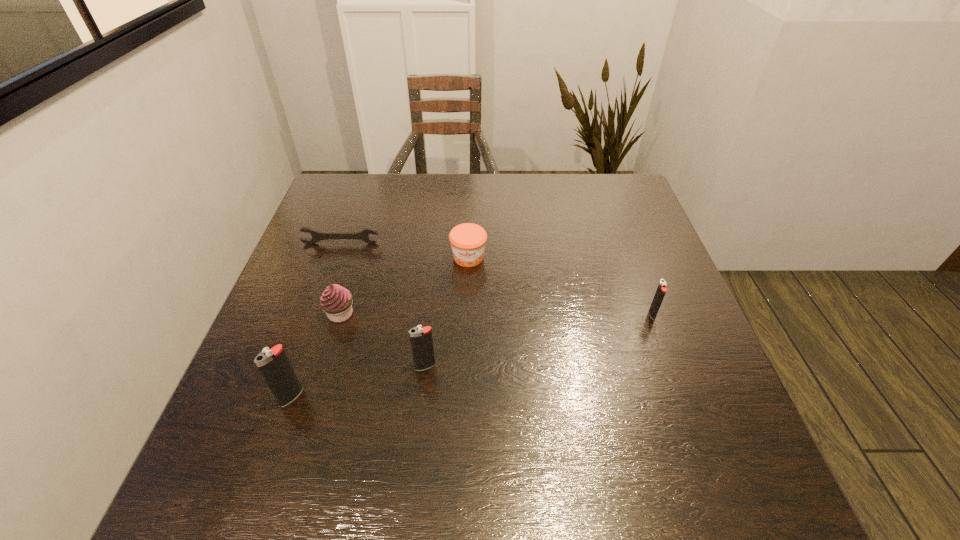
The height and width of the screenshot is (540, 960). What are the coordinates of `the tallest object` in the screenshot? It's located at (274, 365).

Where is `the nearest object`? The image size is (960, 540). the nearest object is located at coordinates (274, 365).

In order to click on the fifth shortest object in this screenshot , I will do tap(421, 340).

Where is `the second tallest igniter`? This screenshot has width=960, height=540. the second tallest igniter is located at coordinates (421, 340).

Find the location of `the farthest igniter`. the farthest igniter is located at coordinates (661, 290).

Locate an element on the screen. the rightmost igniter is located at coordinates (661, 290).

Find the location of a particular element. This screenshot has height=540, width=960. jam is located at coordinates (468, 240).

Find the location of a particular element. The image size is (960, 540). the fifth nearest object is located at coordinates (468, 240).

Find the location of a particular element. the farthest object is located at coordinates (317, 236).

The image size is (960, 540). Find the location of `wrench`. wrench is located at coordinates (317, 236).